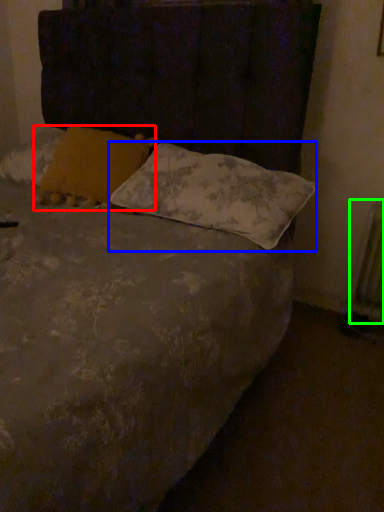
Question: Which object is the closest to the pillow (highlighted by a red box)? Choose among these: pillow (highlighted by a blue box) or radiator (highlighted by a green box).

Choices:
 (A) pillow
 (B) radiator

Answer: (A)